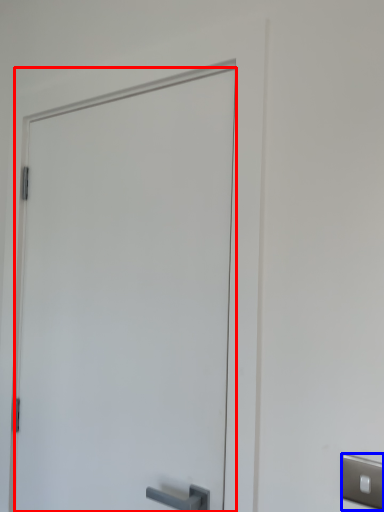
Question: Which object appears closest to the camera in this image, door (highlighted by a red box) or light switch (highlighted by a blue box)?

Choices:
 (A) door
 (B) light switch

Answer: (B)